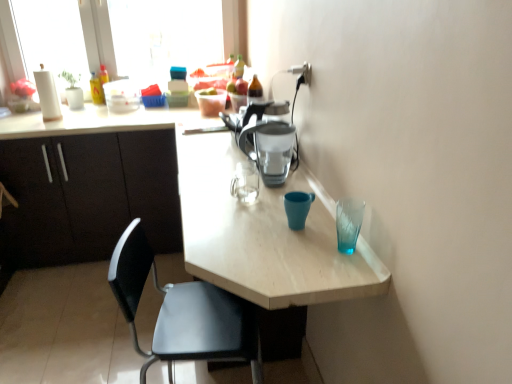
Identify the location of free space in front of matte plastic coffee pot at center. Image resolution: width=512 pixels, height=384 pixels. [x=267, y=205].